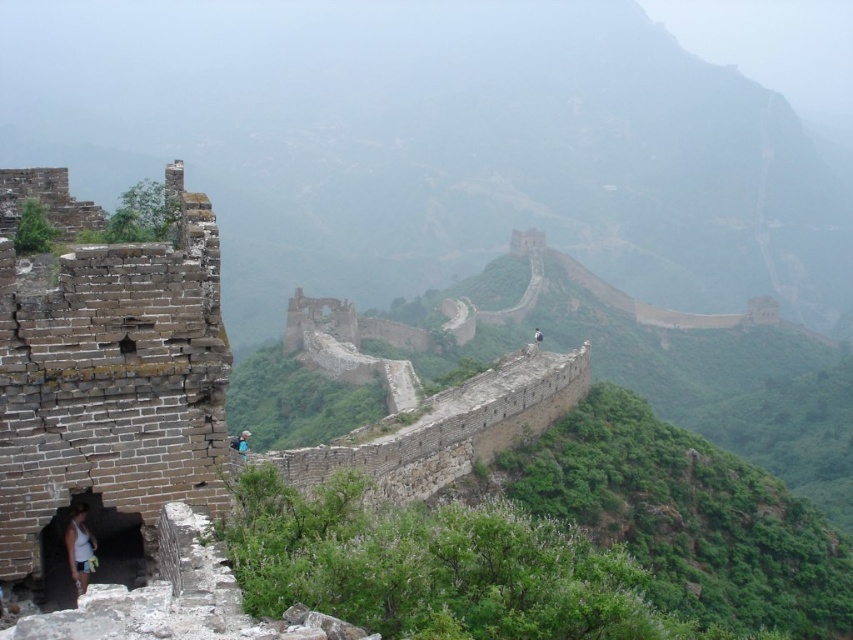
Question: Estimate the real-world distances between objects in this image. Which object is farther from the dark blue fabric backpack at center?

Choices:
 (A) dark blue fabric person at center
 (B) foggy stone wall at center
 (C) white cotton tank top at lower left

Answer: (B)

Question: From the image, what is the correct spatial relationship of foggy stone wall at center in relation to dark blue fabric person at center?

Choices:
 (A) right
 (B) left

Answer: (A)

Question: Does dark blue fabric backpack at center lie in front of dark blue fabric person at center?

Choices:
 (A) yes
 (B) no

Answer: (A)

Question: Among these points, which one is farthest from the camera?

Choices:
 (A) (74, 548)
 (B) (241, 444)
 (C) (581, 17)
 (D) (540, 337)

Answer: (C)

Question: Which point is farther to the camera?

Choices:
 (A) (73, 541)
 (B) (509, 125)
 (C) (537, 337)

Answer: (B)

Question: Is foggy stone wall at center thinner than dark blue fabric person at center?

Choices:
 (A) yes
 (B) no

Answer: (B)